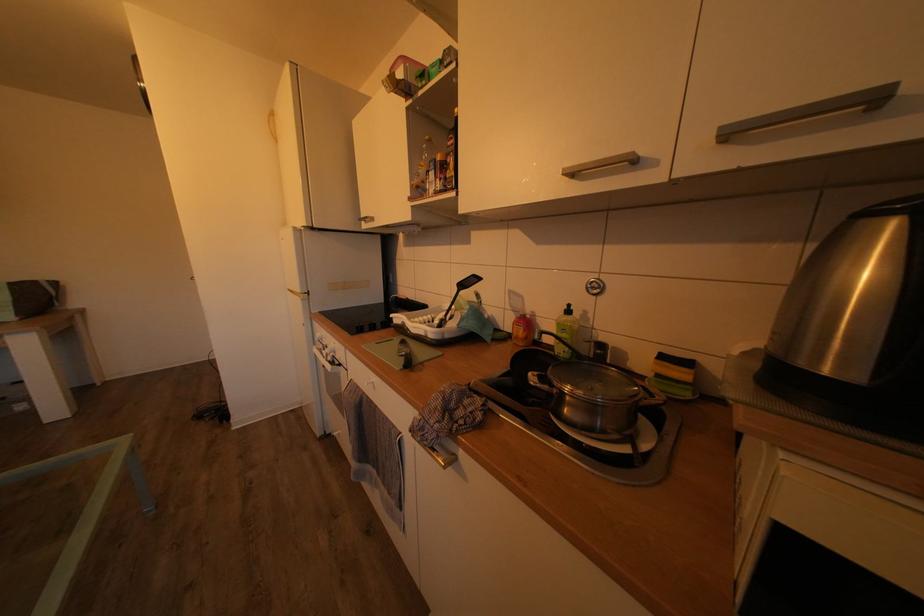
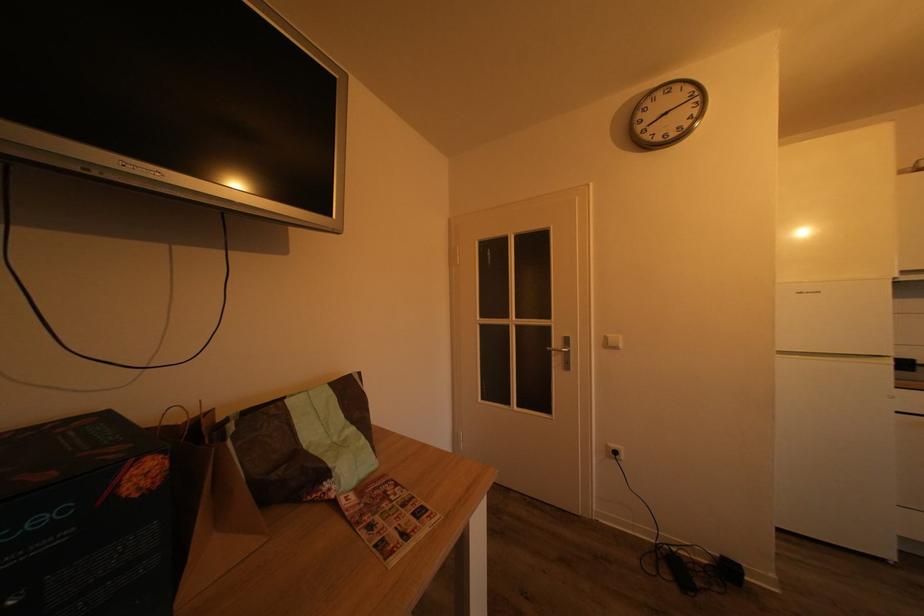
Question: Which direction would the cameraman need to move to produce the second image? Reply with the corresponding letter.

Choices:
 (A) Left
 (B) Right
 (C) Forward
 (D) Backward

Answer: (A)